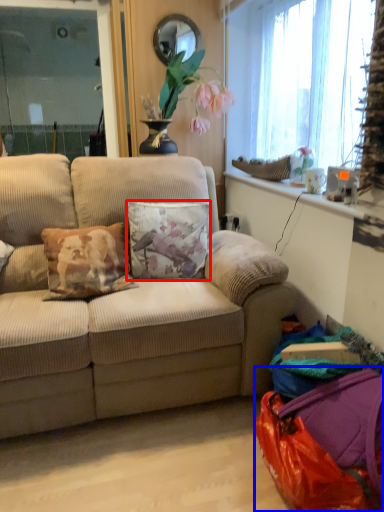
Question: Which object is closer to the camera taking this photo, pillow (highlighted by a red box) or bag (highlighted by a blue box)?

Choices:
 (A) pillow
 (B) bag

Answer: (B)